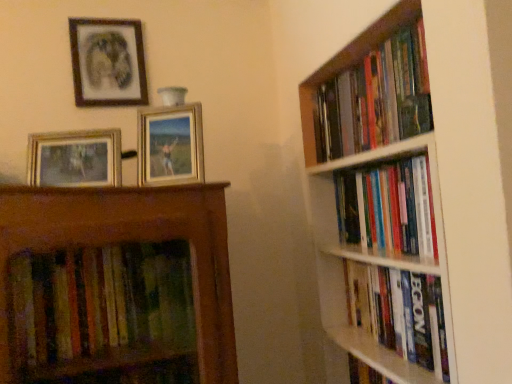
Locate an element on the screen. This screenshot has width=512, height=384. empty space that is ontop of white wooden bookshelf at right (from a real-world perspective) is located at coordinates (360, 41).